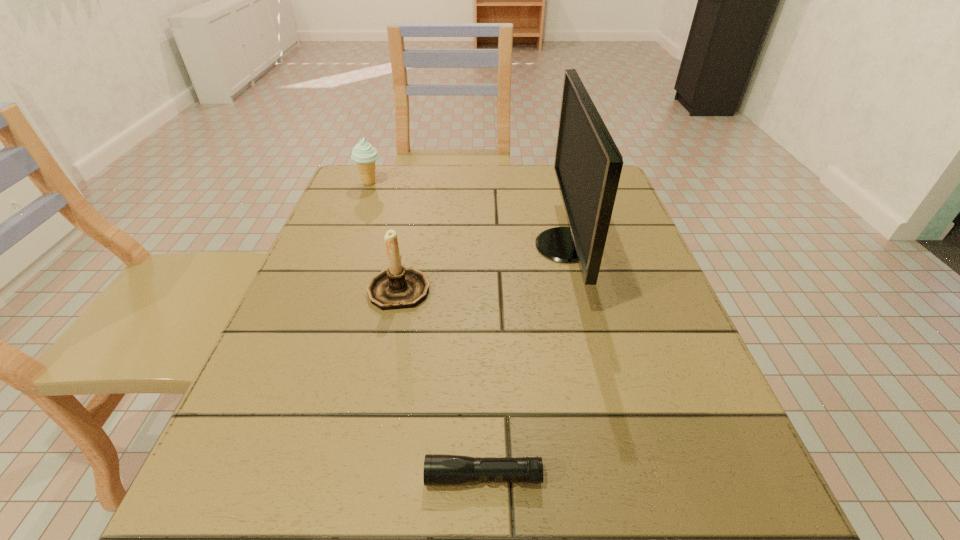
This screenshot has height=540, width=960. I want to click on icecream at the left edge, so click(x=363, y=153).

Locate an element on the screen. This screenshot has width=960, height=540. object located at the right edge is located at coordinates (588, 164).

The width and height of the screenshot is (960, 540). Identify the location of object that is at the far left corner. (363, 153).

The height and width of the screenshot is (540, 960). I want to click on object that is at the far right corner, so click(x=588, y=164).

In the image, there is a desktop. Identify the location of vacant space at the far edge. This screenshot has height=540, width=960. (515, 185).

The image size is (960, 540). In order to click on vacant area at the left edge of the desktop in this screenshot , I will do `click(341, 415)`.

You are a GUI agent. You are given a task and a screenshot of the screen. Output one action in this format:
    pyautogui.click(x=<x>, y=<y>)
    Task: Click on the blank space at the right edge of the desktop
    
    Given the screenshot: What is the action you would take?
    point(627,220)

In the image, there is a desktop. Find the location of `vacant space at the far left corner`. vacant space at the far left corner is located at coordinates (359, 174).

In the image, there is a desktop. Identify the location of vacant space at the near left corner. (239, 488).

Identify the location of vacant space at the near right corner of the desktop. (694, 539).